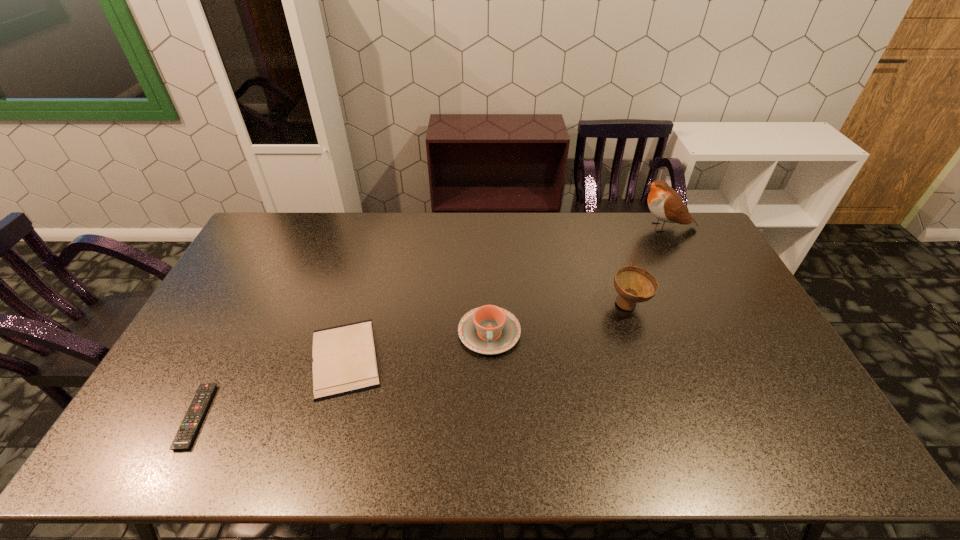
Locate an element on the screen. free space that satisfies the following two spatial constraints: 1. at the face of the farthest object; 2. on the handle side of the third shortest object is located at coordinates (719, 333).

Identify the location of vacant space that satisfies the following two spatial constraints: 1. at the face of the rightmost object; 2. on the handle side of the chinaware. (719, 333).

Where is `vacant space that satisfies the following two spatial constraints: 1. at the face of the bird; 2. on the front side of the fourth shortest object`? The height and width of the screenshot is (540, 960). vacant space that satisfies the following two spatial constraints: 1. at the face of the bird; 2. on the front side of the fourth shortest object is located at coordinates (705, 305).

Image resolution: width=960 pixels, height=540 pixels. What are the coordinates of `free spot that satisfies the following two spatial constraints: 1. at the face of the farthest object; 2. on the front side of the fourth tallest object` in the screenshot? It's located at (732, 357).

This screenshot has width=960, height=540. Identify the location of free point that satisfies the following two spatial constraints: 1. on the back side of the second object from left to right; 2. on the right side of the fourth shortest object. (360, 305).